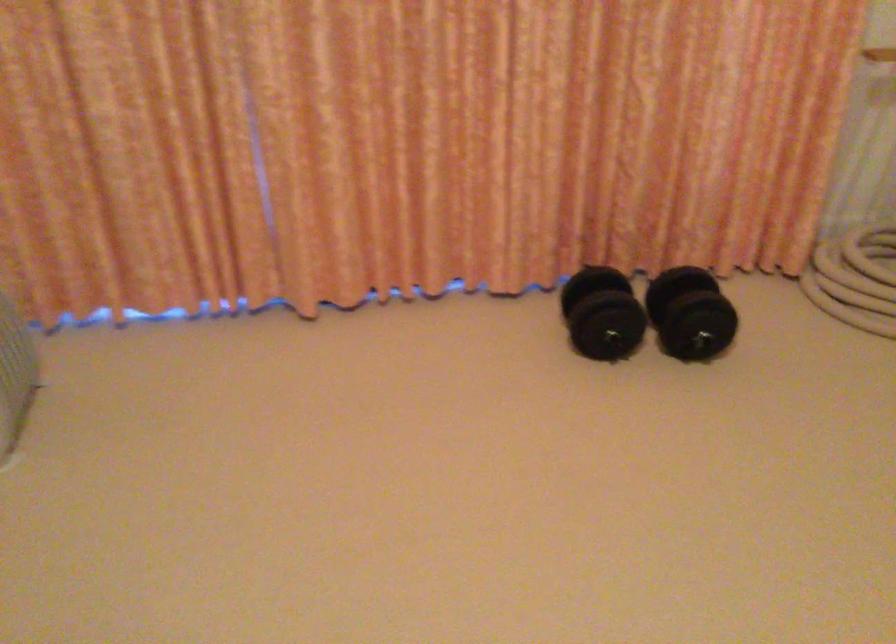
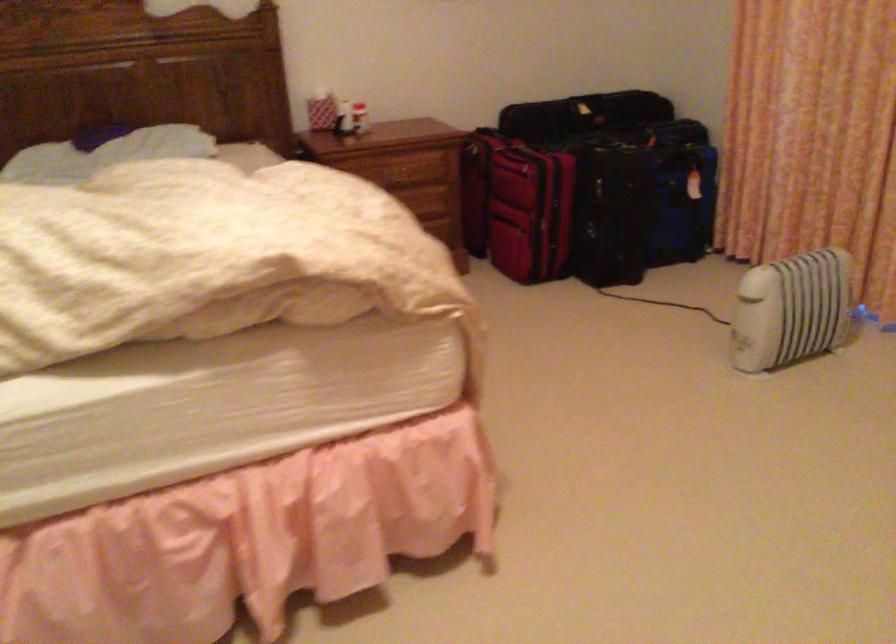
Question: The camera is either moving clockwise (left) or counter-clockwise (right) around the object. The first image is from the beginning of the video and the second image is from the end. Is the camera moving left or right when shooting the video?

Choices:
 (A) Left
 (B) Right

Answer: (B)